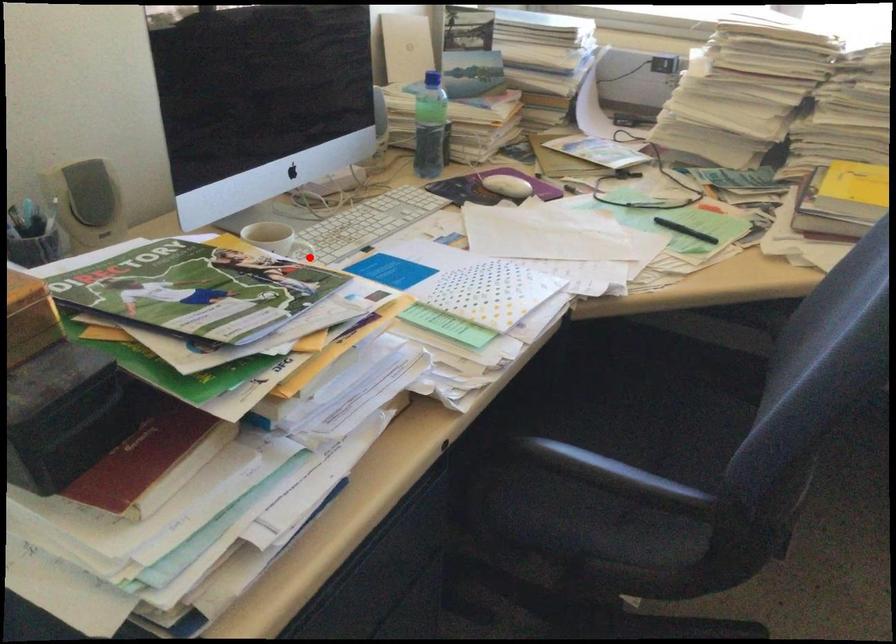
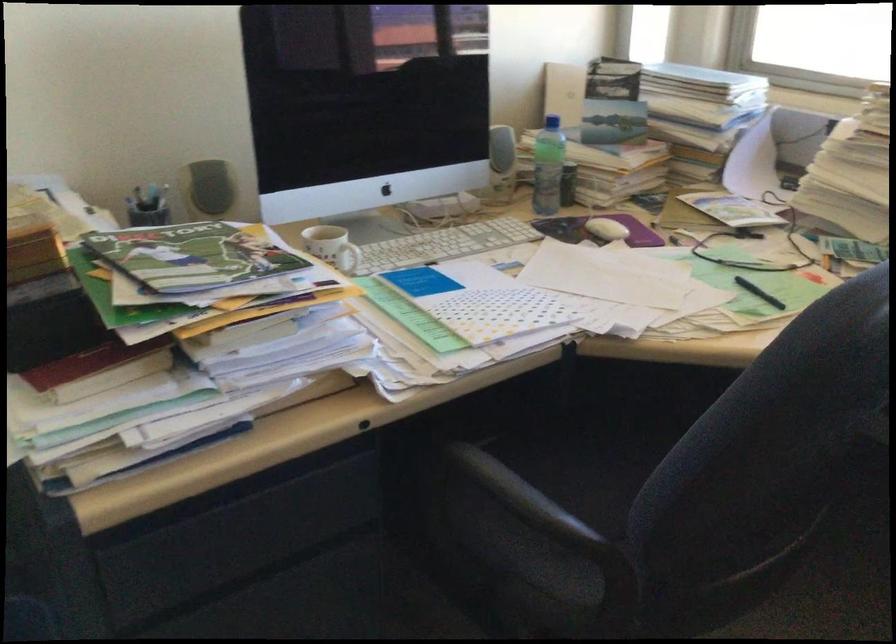
Find the pixel in the second image that matches the highlighted location in the first image.

(348, 258)